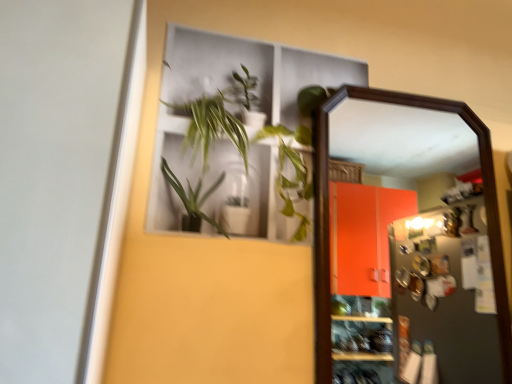
Describe the element at coordinates (408, 245) in the screenshot. I see `wooden-framed mirror at right` at that location.

Measure the distance between point (447, 242) and camera.

The depth of point (447, 242) is 4.43 feet.

The image size is (512, 384). I want to click on wooden-framed mirror at right, so click(x=408, y=245).

Where is `wooden-framed mirror at right`? The image size is (512, 384). wooden-framed mirror at right is located at coordinates (408, 245).